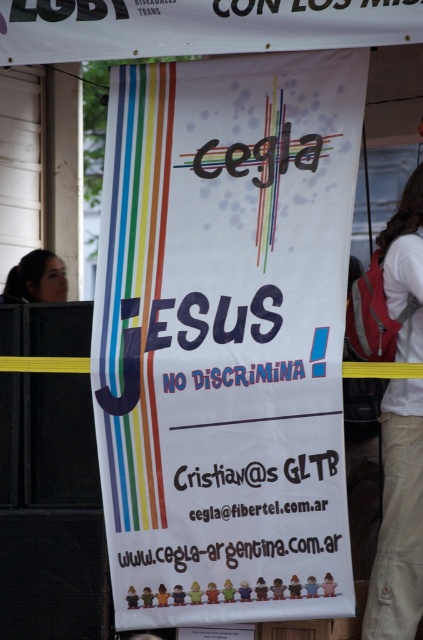
Question: Which object is farther from the camera taking this photo?

Choices:
 (A) matte black hair at left
 (B) white paper banner at center
 (C) white paper banner at upper center

Answer: (A)

Question: Which of these objects is positioned farthest from the matte black hair at left?

Choices:
 (A) white cotton shirt at right
 (B) white paper banner at center
 (C) white paper banner at upper center

Answer: (A)

Question: Can you confirm if white paper banner at upper center is positioned below matte black hair at left?

Choices:
 (A) no
 (B) yes

Answer: (A)

Question: Is the position of white paper banner at center more distant than that of matte black hair at left?

Choices:
 (A) no
 (B) yes

Answer: (A)

Question: Which is farther from the matte black hair at left?

Choices:
 (A) white paper banner at upper center
 (B) white paper banner at center

Answer: (A)

Question: Is white paper banner at center bigger than white paper banner at upper center?

Choices:
 (A) yes
 (B) no

Answer: (A)